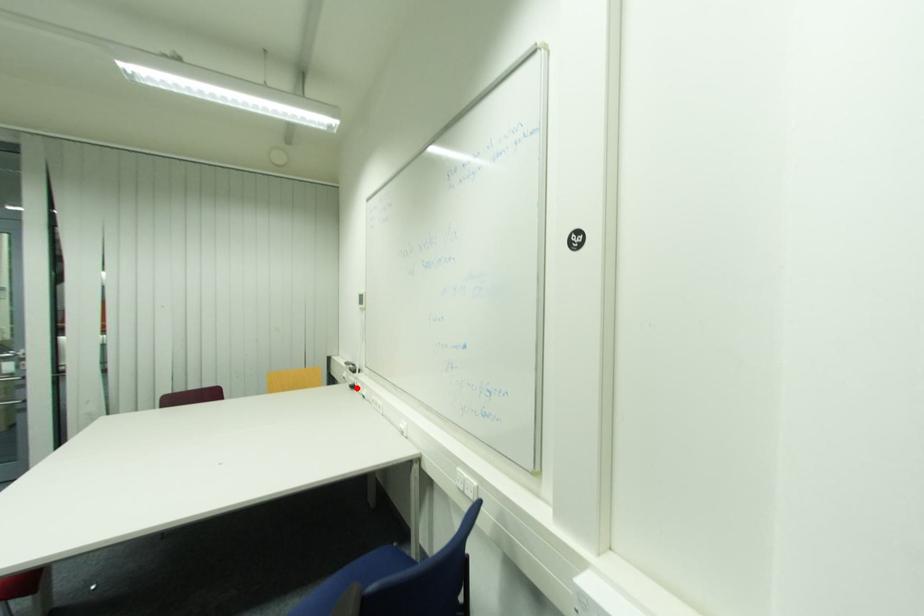
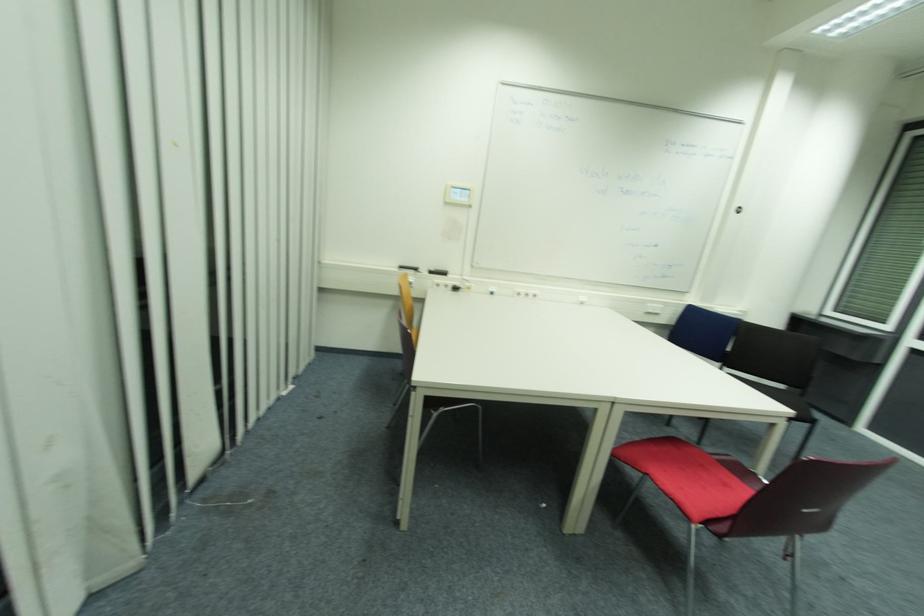
The point at the highlighted location is marked in the first image. Where is the corresponding point in the second image?

(458, 290)